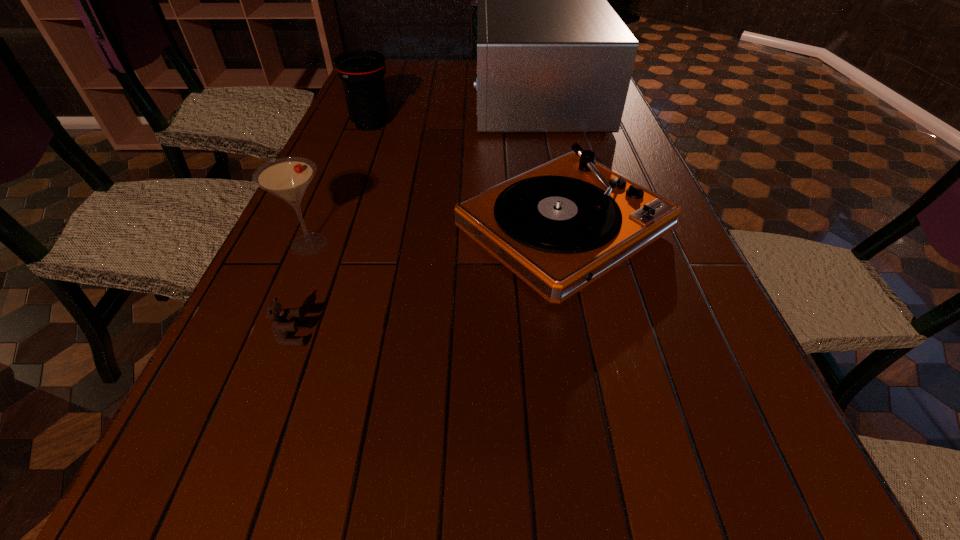
This screenshot has width=960, height=540. I want to click on the tallest object, so click(x=553, y=56).

Identify the location of telephoto lens. (362, 72).

You are a GUI agent. You are given a task and a screenshot of the screen. Output one action in this format:
    pyautogui.click(x=<x>, y=<y>)
    Task: Click on the martini
    The width and height of the screenshot is (960, 540).
    Given the screenshot: What is the action you would take?
    pyautogui.click(x=288, y=178)

Find the location of a particular element. The height and width of the screenshot is (540, 960). the second shortest object is located at coordinates click(560, 226).

Locate an element on the screen. The width and height of the screenshot is (960, 540). teddy bear is located at coordinates (281, 327).

What are the coordinates of `the nearest object` in the screenshot? It's located at (281, 327).

You are a GUI agent. You are given a task and a screenshot of the screen. Output one action in this format:
    pyautogui.click(x=<x>, y=<y>)
    Task: Click on the free space located 0.300m with the door open on the microwave oven
    
    Given the screenshot: What is the action you would take?
    pyautogui.click(x=386, y=104)

I want to click on free space located with the door open on the microwave oven, so tap(368, 104).

Where is `free spot located with the door open on the microwave oven`? This screenshot has height=540, width=960. free spot located with the door open on the microwave oven is located at coordinates (403, 104).

This screenshot has height=540, width=960. Identify the location of free space located on the front of the telephoto lens. (347, 188).